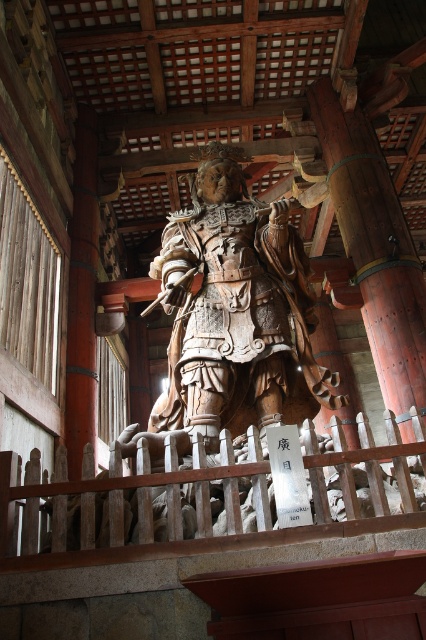
How distant is wooden statue at center from wooden at center?

wooden statue at center and wooden at center are 7.65 meters apart from each other.

Based on the photo, does wooden statue at center appear on the right side of wooden at center?

Yes, wooden statue at center is to the right of wooden at center.

The height and width of the screenshot is (640, 426). In order to click on wooden statue at center in this screenshot , I will do `click(233, 314)`.